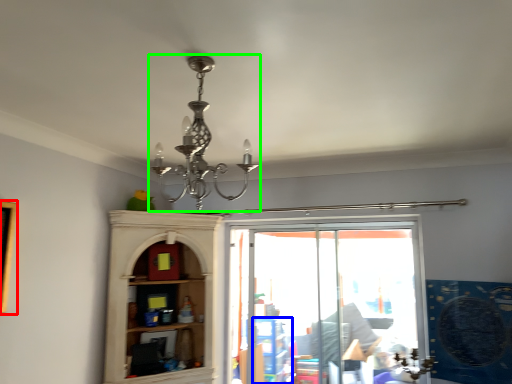
Question: Which object is the farthest from picture frame (highlighted by a red box)? Choose among these: shelf (highlighted by a blue box) or lamp (highlighted by a green box).

Choices:
 (A) shelf
 (B) lamp

Answer: (A)